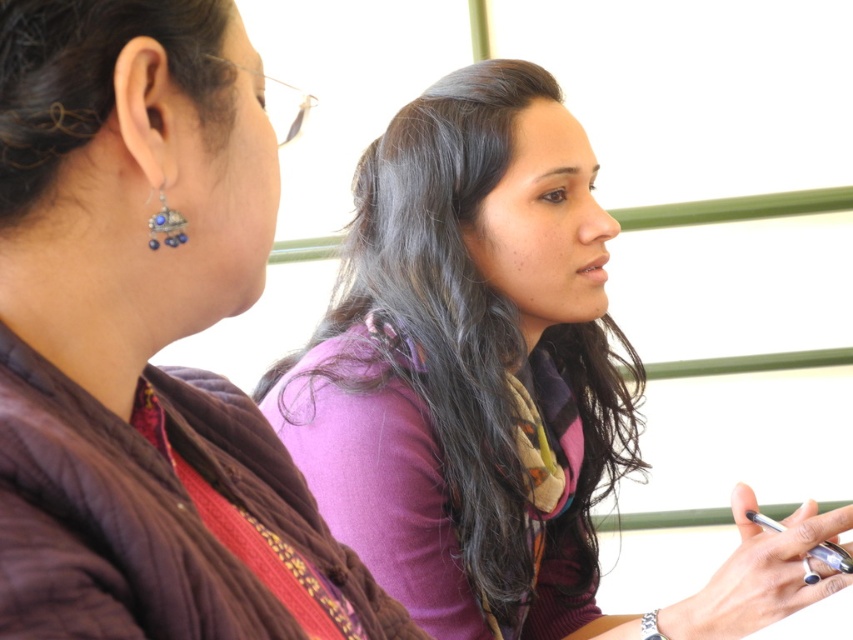
Question: Is purple soft scarf at center to the left of sapphire-studded silver earring at left from the viewer's perspective?

Choices:
 (A) yes
 (B) no

Answer: (B)

Question: Which of the following is the closest to the observer?

Choices:
 (A) (486, 243)
 (B) (175, 220)

Answer: (B)

Question: Does brown fabric scarf at upper center appear over purple soft scarf at center?

Choices:
 (A) yes
 (B) no

Answer: (B)

Question: Can you confirm if brown fabric scarf at upper center is bigger than sapphire-studded silver earring at left?

Choices:
 (A) no
 (B) yes

Answer: (B)

Question: Estimate the real-world distances between objects in this image. Which object is farther from the sapphire-studded silver earring at left?

Choices:
 (A) purple soft scarf at center
 (B) brown fabric scarf at upper center

Answer: (A)

Question: Which of the following is the closest to the observer?

Choices:
 (A) brown fabric scarf at upper center
 (B) sapphire-studded silver earring at left
 (C) purple soft scarf at center

Answer: (A)